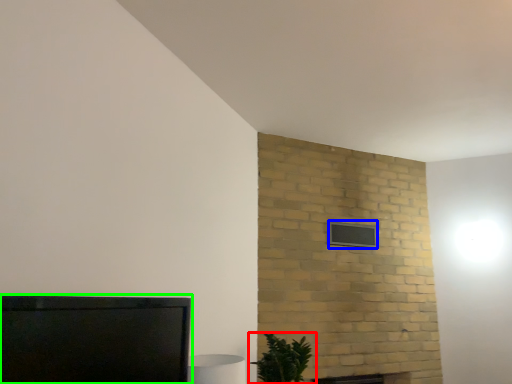
Question: Estimate the real-world distances between objects in this image. Which object is farther from houseplant (highlighted by a red box), window (highlighted by a blue box) or furniture (highlighted by a green box)?

Choices:
 (A) window
 (B) furniture

Answer: (B)